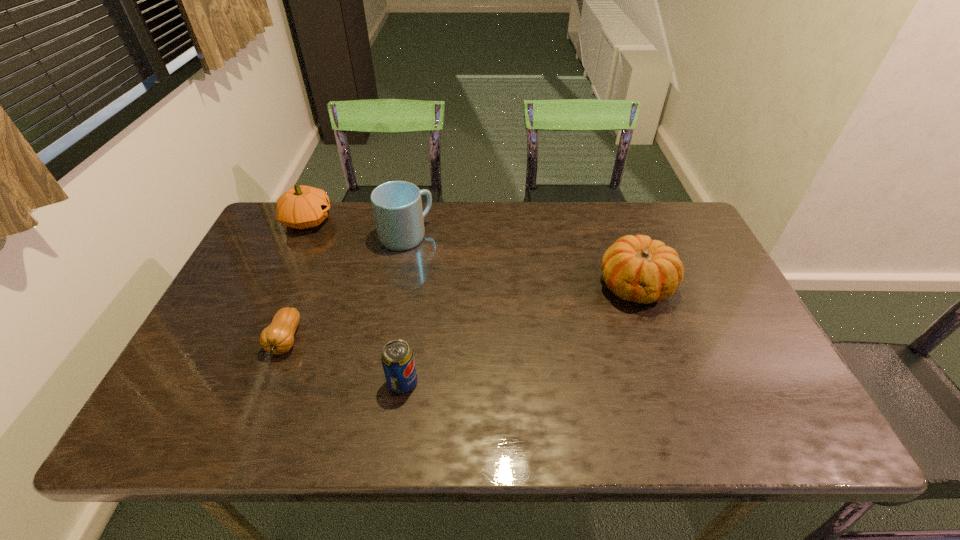
Where is `free spot at the right edge of the desktop`? free spot at the right edge of the desktop is located at coordinates (682, 293).

The height and width of the screenshot is (540, 960). In the image, there is a desktop. In order to click on vacant space at the far left corner in this screenshot , I will do `click(266, 225)`.

What are the coordinates of `free spot at the near left corner of the desktop` in the screenshot? It's located at (178, 420).

I want to click on blank region between the nearest object and the shortest object, so click(x=344, y=361).

Image resolution: width=960 pixels, height=540 pixels. I want to click on free space that is in between the shortest object and the mug, so click(x=346, y=288).

This screenshot has width=960, height=540. Find the location of `free space between the nearest object and the nearest gourd`. free space between the nearest object and the nearest gourd is located at coordinates (344, 361).

I want to click on unoccupied position between the nearest object and the third nearest object, so click(x=519, y=334).

At what (x,y) coordinates should I click in order to perform the action: click on vacant area that lies between the shortest gourd and the soda. Please return your answer as a coordinate pair (x, y). This screenshot has width=960, height=540. Looking at the image, I should click on (344, 361).

Locate an element on the screen. This screenshot has height=540, width=960. vacant space that's between the nearest object and the shortest gourd is located at coordinates (344, 361).

What are the coordinates of `free spot between the second nearest object and the second nearest gourd` in the screenshot? It's located at (461, 313).